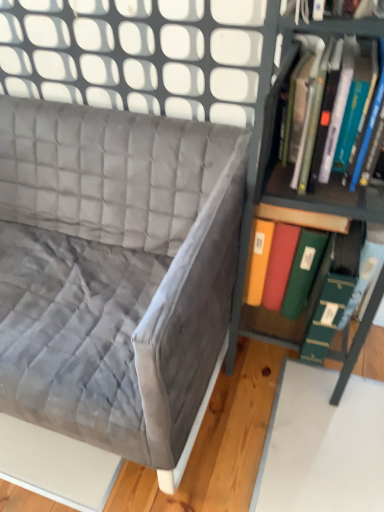
Question: Looking at their shapes, would you say hardcover book at right, which ranks as the first book in top-to-bottom order, is wider or thinner than metallic green bookshelf at right?

Choices:
 (A) wide
 (B) thin

Answer: (B)

Question: Considering the positions of point (324, 114) and point (244, 245), is point (324, 114) closer or farther from the camera than point (244, 245)?

Choices:
 (A) farther
 (B) closer

Answer: (B)

Question: Which object is positioned closest to the hardcover book at right, the second book in the bottom-to-top sequence?

Choices:
 (A) metallic green bookshelf at right
 (B) velvet gray couch at upper left
 (C) green matte folder at right, acting as the first book starting from the bottom

Answer: (A)

Question: Based on their relative distances, which object is nearer to the metallic green bookshelf at right?

Choices:
 (A) green matte folder at right, the second book viewed from the top
 (B) velvet gray couch at upper left
 (C) hardcover book at right, the second book in the bottom-to-top sequence

Answer: (A)